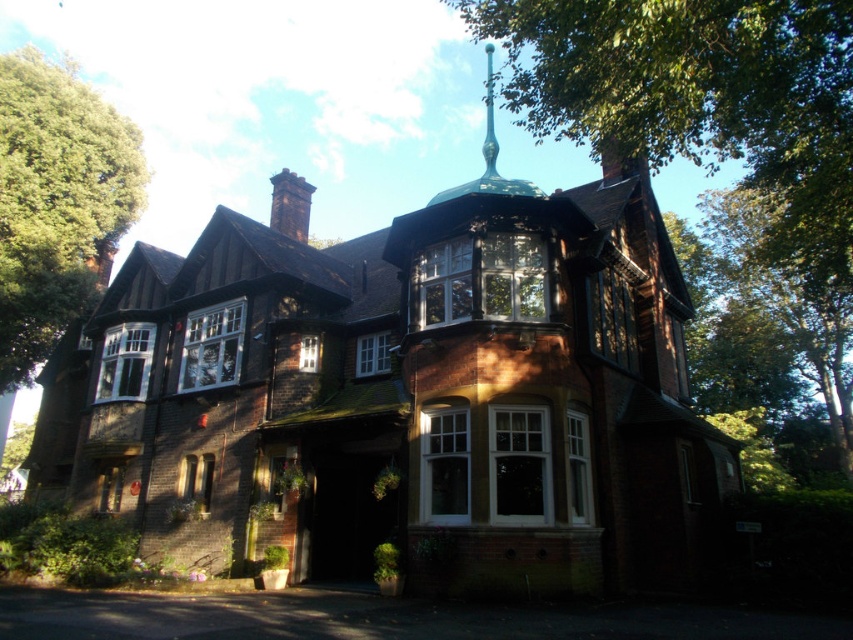
Which is more to the left, green leafy tree at upper center or green leafy tree at upper left?

From the viewer's perspective, green leafy tree at upper left appears more on the left side.

Does green leafy tree at upper center have a lesser height compared to green leafy tree at upper left?

No, green leafy tree at upper center is not shorter than green leafy tree at upper left.

Where is `green leafy tree at upper center`? Image resolution: width=853 pixels, height=640 pixels. green leafy tree at upper center is located at coordinates (718, 157).